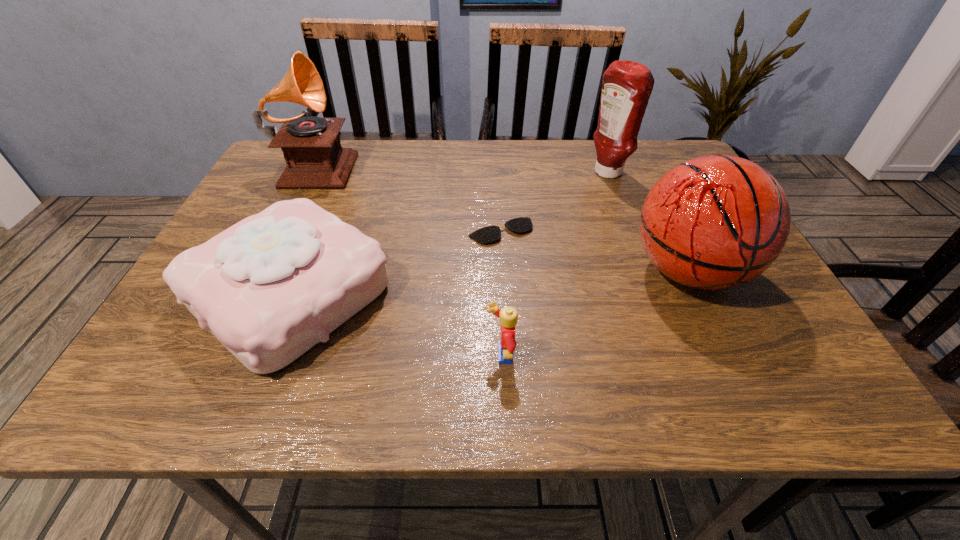
Image resolution: width=960 pixels, height=540 pixels. I want to click on vacant space located on the face of the fifth tallest object, so click(x=325, y=356).

This screenshot has width=960, height=540. I want to click on free location located 0.140m on the face of the fifth tallest object, so click(406, 356).

Locate an element on the screen. vacant space located 0.310m on the face of the fifth tallest object is located at coordinates (308, 356).

Where is `free space located on the left of the spectacles`? Image resolution: width=960 pixels, height=540 pixels. free space located on the left of the spectacles is located at coordinates (333, 232).

I want to click on phonograph record present at the far edge, so click(311, 146).

I want to click on condiment that is positioned at the far edge, so click(x=627, y=86).

Where is `cake situated at the near edge`? The width and height of the screenshot is (960, 540). cake situated at the near edge is located at coordinates (270, 287).

You are a GUI agent. You are given a task and a screenshot of the screen. Output one action in this format:
    pyautogui.click(x=<x>, y=<y>)
    Task: Click on the Lego at the near edge
    This screenshot has width=960, height=540.
    Given the screenshot: What is the action you would take?
    pyautogui.click(x=508, y=316)

You are a GUI agent. You are given a task and a screenshot of the screen. Output one action in this format:
    pyautogui.click(x=<x>, y=<y>)
    Task: Click on the phonograph record that is at the left edge
    This screenshot has width=960, height=540.
    Given the screenshot: What is the action you would take?
    pyautogui.click(x=311, y=146)

Image resolution: width=960 pixels, height=540 pixels. What are the coordinates of `cake present at the left edge` in the screenshot? It's located at (270, 287).